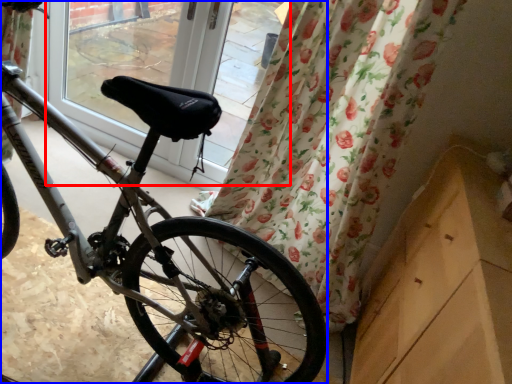
Question: Which of the following is the farthest to the observer, window screen (highlighted by a red box) or bicycle (highlighted by a blue box)?

Choices:
 (A) window screen
 (B) bicycle

Answer: (A)